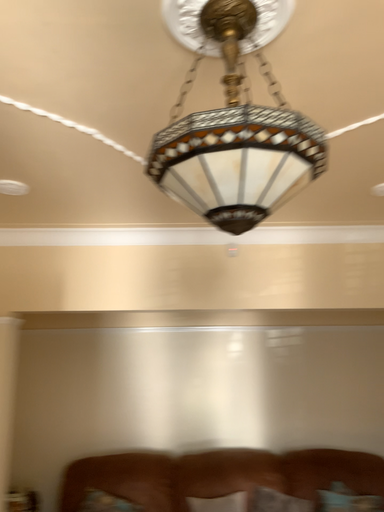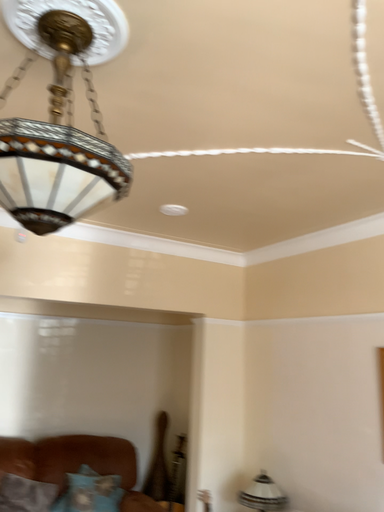
Question: How did the camera likely rotate when shooting the video?

Choices:
 (A) rotated right
 (B) rotated left

Answer: (A)